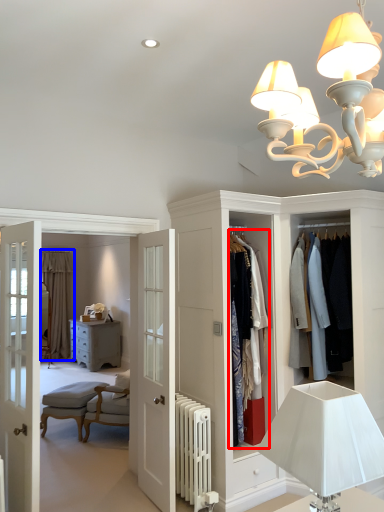
Question: Which object is further to the camera taking this photo, clothing (highlighted by a red box) or curtain (highlighted by a blue box)?

Choices:
 (A) clothing
 (B) curtain

Answer: (B)